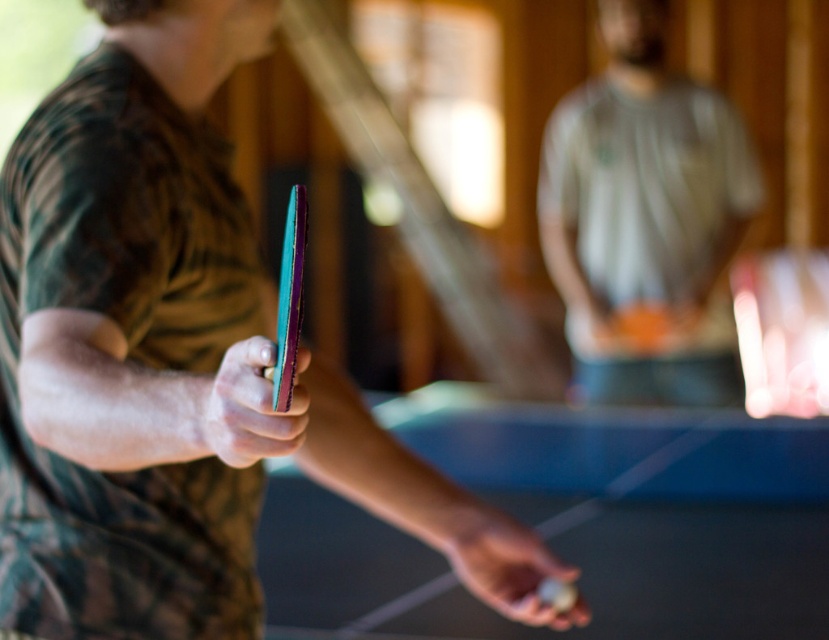
Question: Which of these objects is positioned closest to the teal rubber paddle at center?

Choices:
 (A) white matte ping pong ball at center
 (B) matte gray shirt at center
 (C) shiny metallic racket at center
 (D) multicolored wooden paddle at center

Answer: (C)

Question: Which of the following is the farthest from the observer?

Choices:
 (A) (222, 369)
 (B) (531, 609)

Answer: (B)

Question: Among these objects, which one is nearest to the camera?

Choices:
 (A) teal rubber paddle at center
 (B) white matte ping pong ball at center
 (C) matte gray shirt at center
 (D) shiny metallic racket at center

Answer: (D)

Question: Considering the relative positions of matte gray shirt at center and shiny metallic racket at center in the image provided, where is matte gray shirt at center located with respect to shiny metallic racket at center?

Choices:
 (A) left
 (B) right

Answer: (B)

Question: From the image, what is the correct spatial relationship of multicolored wooden paddle at center in relation to shiny metallic racket at center?

Choices:
 (A) above
 (B) below

Answer: (B)

Question: Can you confirm if teal rubber paddle at center is positioned above multicolored wooden paddle at center?

Choices:
 (A) no
 (B) yes

Answer: (B)